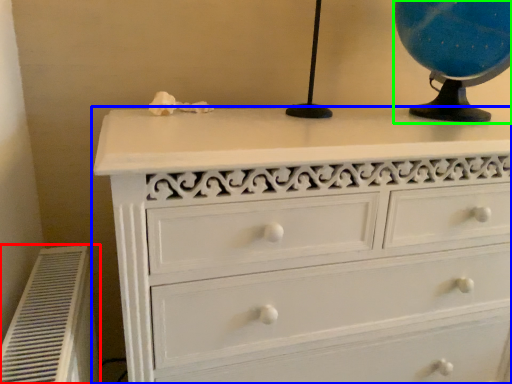
Question: Which object is the farthest from air conditioner (highlighted by a red box)? Choose among these: chest of drawers (highlighted by a blue box) or table lamp (highlighted by a green box).

Choices:
 (A) chest of drawers
 (B) table lamp

Answer: (B)